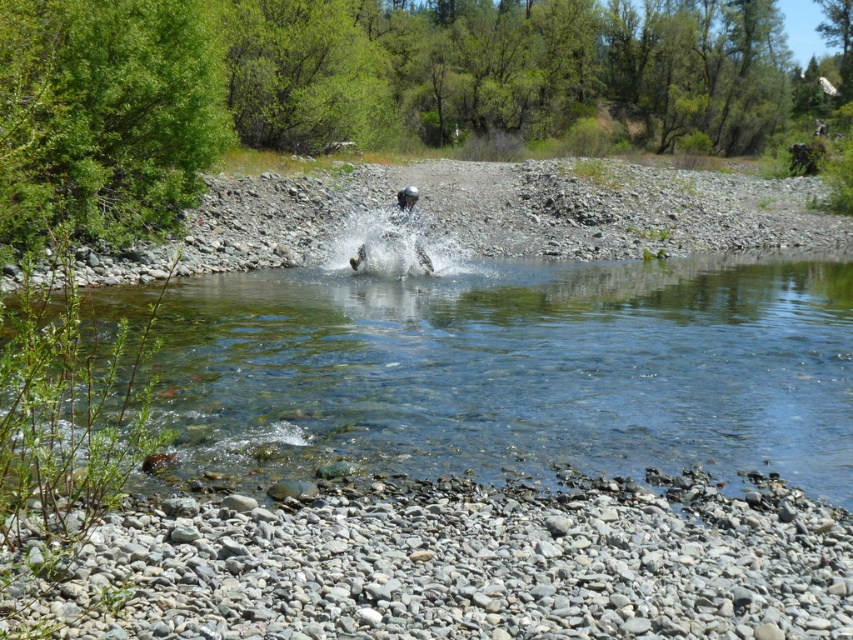
From the picture: You are standing on the gray gravel at lower center and want to reach the clear water splash at center. Which direction should you move to get closer to the splash?

The gray gravel at lower center is below the clear water splash at center, so you should move upward to get closer to the splash.

You are standing at the point with coordinates point (515, 369). What is the name of the body of water you are currently on?

The point (515, 369) is on clear glass lake at center.